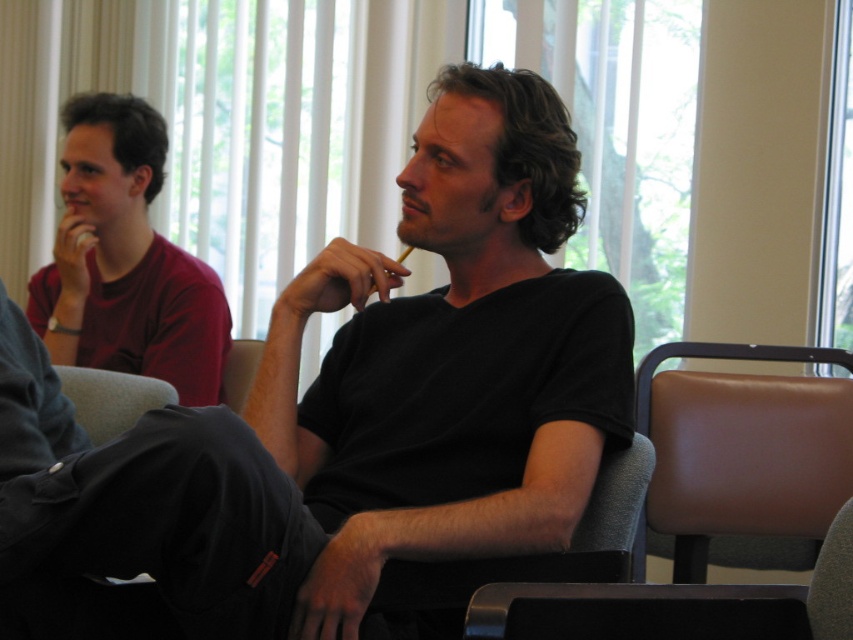
You are standing at the center of the room. The brown leather chair at right is represented by point (741, 460). Which direction should you move to reach the brown leather chair at right?

The brown leather chair at right is located at coordinates (741, 460). Since you are at the center, you should move towards the right and slightly upwards to reach it.

You are a photographer setting up a shoot in this room. You need to place a small tripod between the black matte shirt at center and the gray fabric chair at lower right. Is there enough space for the tripod?

The black matte shirt at center is positioned over the gray fabric chair at lower right, meaning there is no space between them. Therefore, there is no room to place the tripod between them.